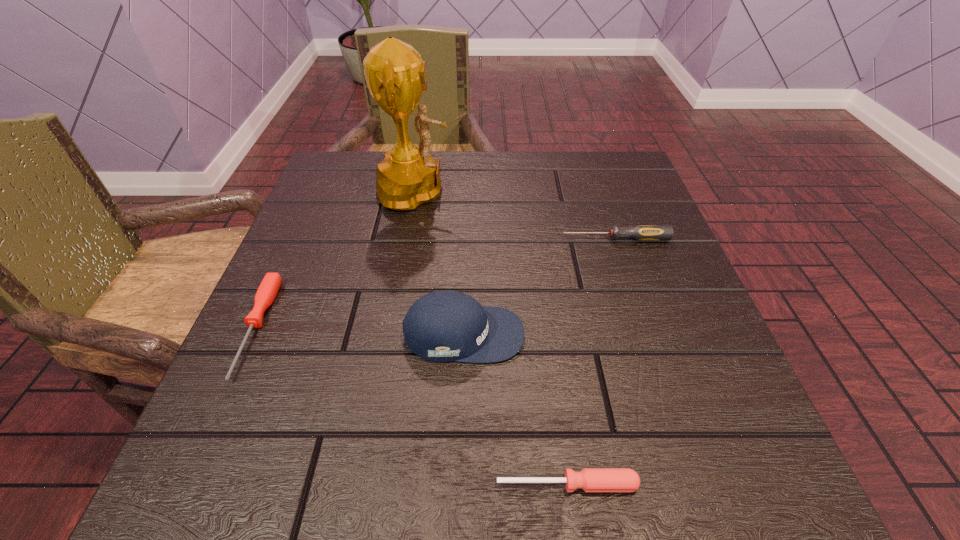
Locate an element on the screen. This screenshot has width=960, height=540. vacant space located 0.240m insert the second farthest object into a screw head is located at coordinates (440, 239).

At what (x,y) coordinates should I click in order to perform the action: click on free space located insert the second farthest object into a screw head. Please return your answer as a coordinate pair (x, y). This screenshot has height=540, width=960. Looking at the image, I should click on (526, 239).

Find the location of a particular element. The image size is (960, 540). vacant area located 0.370m insert the second farthest object into a screw head is located at coordinates (373, 239).

Where is `free space located at the tip of the leftmost object`? free space located at the tip of the leftmost object is located at coordinates (195, 461).

Image resolution: width=960 pixels, height=540 pixels. In order to click on free space located 0.230m on the left of the nearest object in this screenshot , I will do `click(309, 484)`.

Identify the location of object present at the far edge. (396, 75).

The image size is (960, 540). In order to click on object at the near edge in this screenshot , I will do `click(589, 479)`.

Find the location of a particular element. This screenshot has width=960, height=540. award located at the left edge is located at coordinates (396, 75).

This screenshot has height=540, width=960. In order to click on screwdriver that is positioned at the left edge in this screenshot , I will do `click(269, 287)`.

Where is `object located in the right edge section of the desktop`? Image resolution: width=960 pixels, height=540 pixels. object located in the right edge section of the desktop is located at coordinates (642, 233).